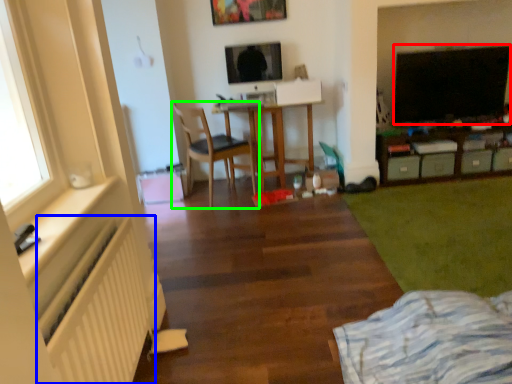
Question: Which object is the farthest from dark (highlighted by a red box)? Choose among these: radiator (highlighted by a blue box) or chair (highlighted by a green box).

Choices:
 (A) radiator
 (B) chair

Answer: (A)